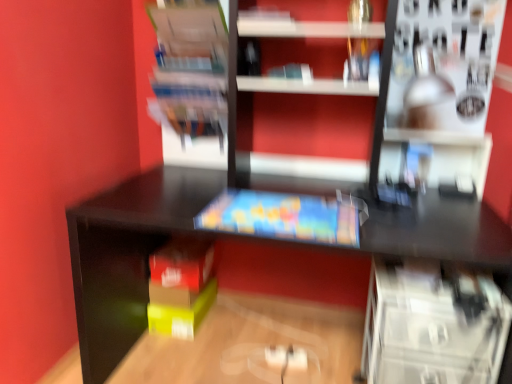
Question: Does transparent plastic drawers at lower right, which is counted as the 1th shelf, starting from the bottom, have a greater width compared to satin silver lamp at upper right, the second shelf positioned from the top?

Choices:
 (A) yes
 (B) no

Answer: (B)

Question: Can we say transparent plastic drawers at lower right, which is counted as the second shelf, starting from the right, lies outside satin silver lamp at upper right, the 2th shelf when ordered from bottom to top?

Choices:
 (A) yes
 (B) no

Answer: (A)

Question: Could you tell me if transparent plastic drawers at lower right, which is counted as the 1th shelf, starting from the bottom, is facing satin silver lamp at upper right, the 2th shelf when ordered from bottom to top?

Choices:
 (A) no
 (B) yes

Answer: (A)

Question: Does transparent plastic drawers at lower right, which is counted as the second shelf, starting from the right, contain satin silver lamp at upper right, the third shelf positioned from the left?

Choices:
 (A) no
 (B) yes

Answer: (A)

Question: Is transparent plastic drawers at lower right, which is counted as the 1th shelf, starting from the bottom, far away from satin silver lamp at upper right, the third shelf positioned from the left?

Choices:
 (A) no
 (B) yes

Answer: (A)

Question: Considering their positions, is matte plastic books at upper left, which is the third shelf in right-to-left order, located in front of or behind transparent plastic drawers at lower right, which is counted as the second shelf, starting from the right?

Choices:
 (A) behind
 (B) front

Answer: (A)

Question: From the image's perspective, is matte plastic books at upper left, which ranks as the 3th shelf in bottom-to-top order, above or below transparent plastic drawers at lower right, which is counted as the second shelf, starting from the right?

Choices:
 (A) above
 (B) below

Answer: (A)

Question: Is point (207, 127) closer or farther from the camera than point (367, 352)?

Choices:
 (A) farther
 (B) closer

Answer: (A)

Question: Is matte plastic books at upper left, which is the first shelf in left-to-right order, situated inside transparent plastic drawers at lower right, which is counted as the 1th shelf, starting from the bottom, or outside?

Choices:
 (A) inside
 (B) outside

Answer: (B)

Question: Is matte plastic book at center wider or thinner than satin silver lamp at upper right, which ranks as the first shelf in right-to-left order?

Choices:
 (A) wide
 (B) thin

Answer: (B)

Question: Relative to satin silver lamp at upper right, which ranks as the first shelf in right-to-left order, is matte plastic book at center in front or behind?

Choices:
 (A) behind
 (B) front

Answer: (A)

Question: From the image's perspective, is matte plastic book at center positioned above or below satin silver lamp at upper right, the third shelf positioned from the left?

Choices:
 (A) below
 (B) above

Answer: (A)

Question: Considering the positions of point tap(275, 193) and point tap(411, 16), is point tap(275, 193) closer or farther from the camera than point tap(411, 16)?

Choices:
 (A) farther
 (B) closer

Answer: (A)

Question: Which is correct: transparent plastic drawers at lower right, which is counted as the 1th shelf, starting from the bottom, is inside matte plastic books at upper left, which ranks as the 3th shelf in bottom-to-top order, or outside of it?

Choices:
 (A) outside
 (B) inside

Answer: (A)

Question: In terms of width, does transparent plastic drawers at lower right, placed as the 2th shelf when sorted from left to right, look wider or thinner when compared to matte plastic books at upper left, the first shelf viewed from the top?

Choices:
 (A) wide
 (B) thin

Answer: (A)